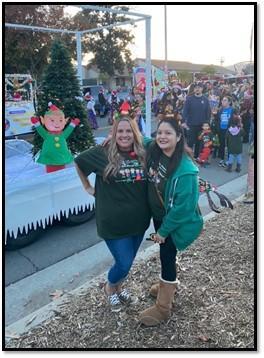
I want to click on christmas tree, so click(53, 80).